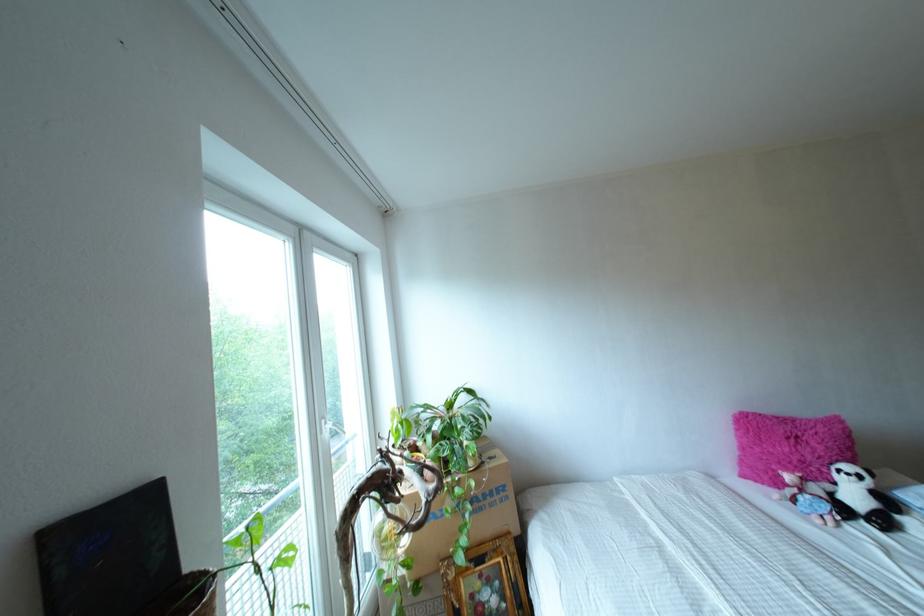
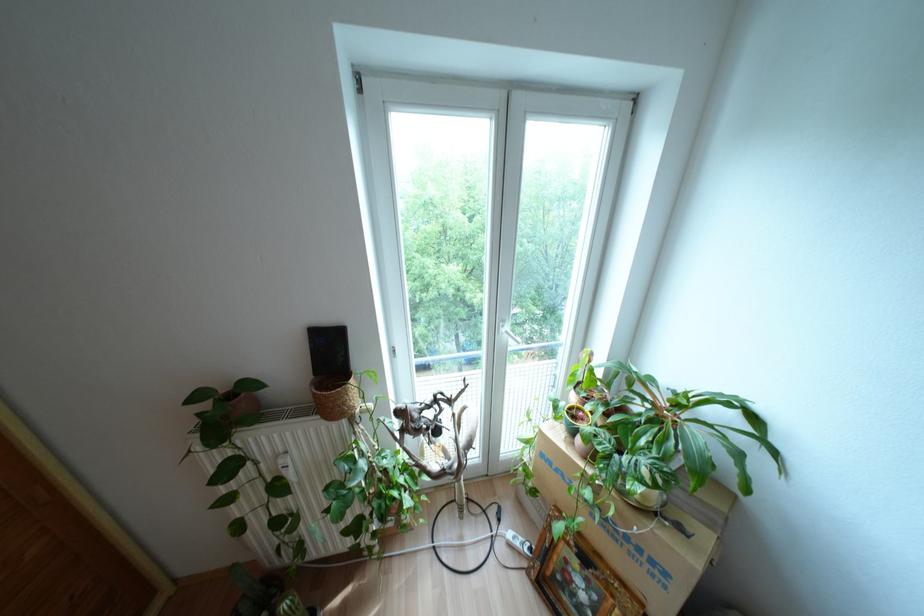
Based on the continuous images, in which direction is the camera rotating?

The camera's rotation is toward left-down.